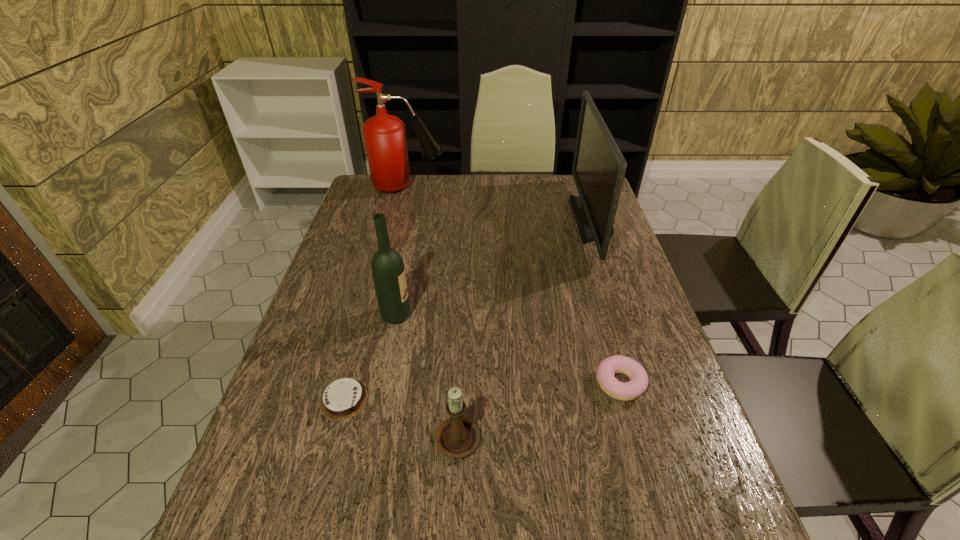
Find the location of a particular element. fire extinguisher is located at coordinates pos(385,139).

This screenshot has width=960, height=540. I want to click on monitor, so click(598, 169).

This screenshot has width=960, height=540. Identify the location of the fourth nearest object. (387, 266).

Image resolution: width=960 pixels, height=540 pixels. In order to click on candle holder in this screenshot , I will do `click(457, 437)`.

Where is `the third object from right to left`? This screenshot has width=960, height=540. the third object from right to left is located at coordinates (457, 437).

This screenshot has height=540, width=960. Find the location of `the fifth tallest object`. the fifth tallest object is located at coordinates coord(606,370).

Where is `the shortest object`? the shortest object is located at coordinates (344, 398).

Image resolution: width=960 pixels, height=540 pixels. Find the location of `vacant space situated 0.230m with the nozzle aimed from the fire extinguisher`. vacant space situated 0.230m with the nozzle aimed from the fire extinguisher is located at coordinates (507, 186).

The width and height of the screenshot is (960, 540). Identify the location of vacant space located 0.310m on the screen side of the monitor. (481, 220).

This screenshot has height=540, width=960. I want to click on free space located on the screen side of the monitor, so click(x=472, y=220).